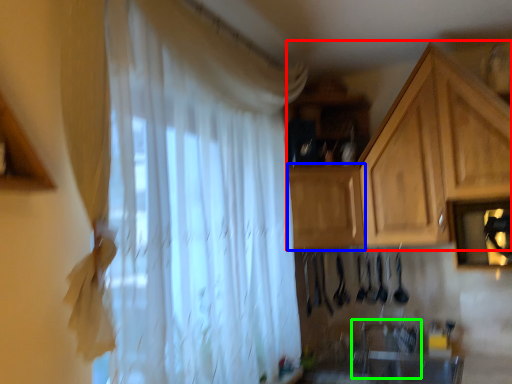
Question: Estimate the real-world distances between objects in this image. Which object is closer to cabinetry (highlighted by a red box), cabinetry (highlighted by a blue box) or sink (highlighted by a green box)?

Choices:
 (A) cabinetry
 (B) sink

Answer: (A)